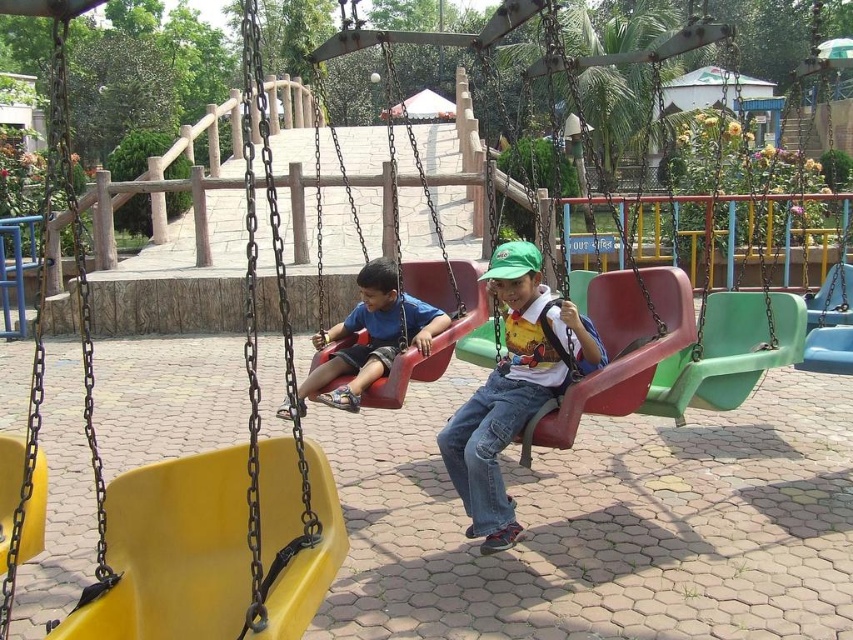
Who is more distant from viewer, (492,400) or (387,356)?

The point (387,356) is behind.

Is matte green cap at center below matte blue shirt at center?

Yes.

This screenshot has width=853, height=640. What do you see at coordinates (514, 387) in the screenshot?
I see `matte green cap at center` at bounding box center [514, 387].

The width and height of the screenshot is (853, 640). Find the location of `matte green cap at center`. matte green cap at center is located at coordinates (514, 387).